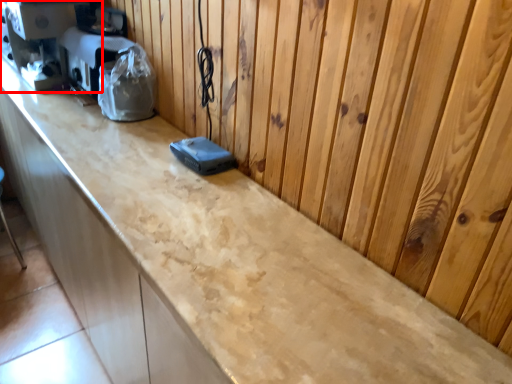
Question: From the image's perspective, where is coffee machine (annotated by the red box) located in relation to appliance in the image?

Choices:
 (A) below
 (B) above

Answer: (B)